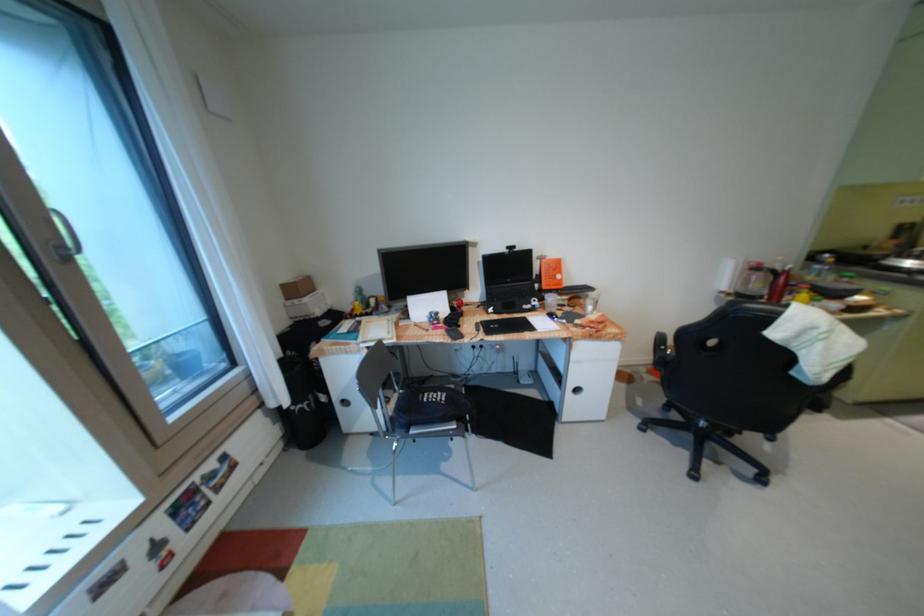
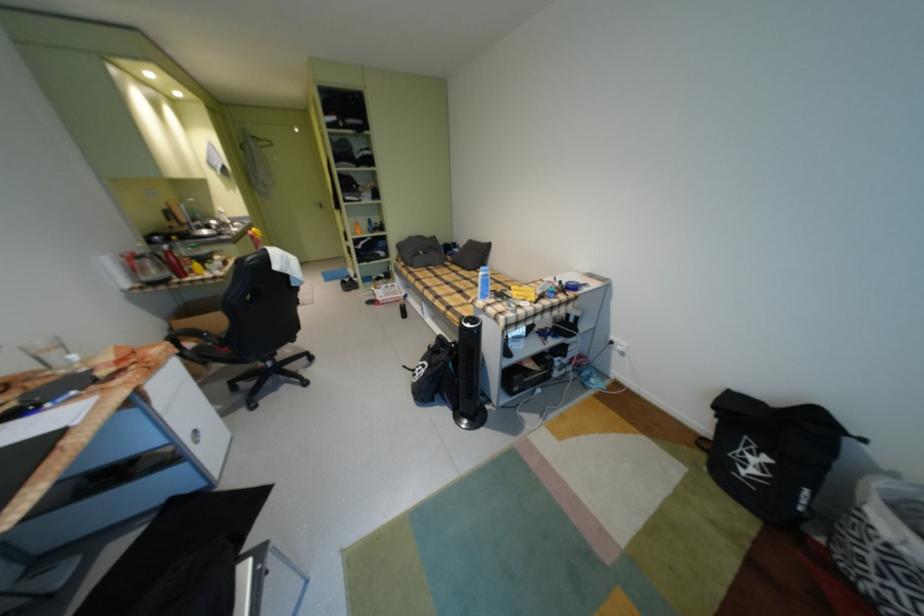
Locate, in the second image, the point that corresponds to (784,334) in the first image.

(286, 268)